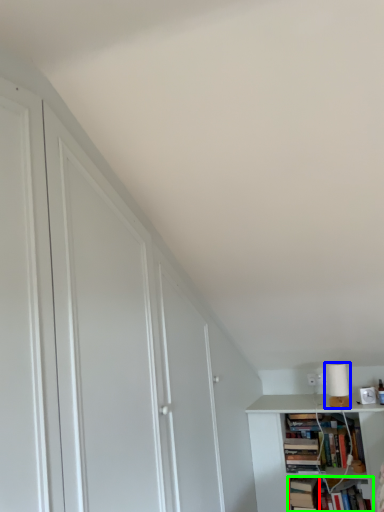
Question: Which is nearer to the book (highlighted by a red box)? lamp (highlighted by a blue box) or book (highlighted by a green box).

Choices:
 (A) lamp
 (B) book

Answer: (B)